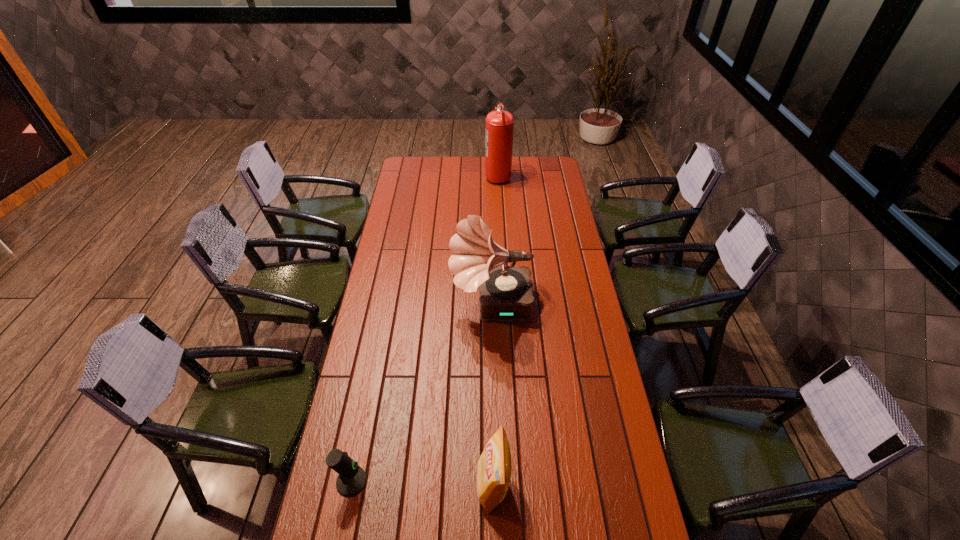
Locate an element on the screen. The height and width of the screenshot is (540, 960). fire extinguisher is located at coordinates (499, 128).

The width and height of the screenshot is (960, 540). In order to click on the third nearest object in this screenshot , I will do `click(506, 292)`.

Find the location of a particular element. the second shortest object is located at coordinates (494, 465).

You are a GUI agent. You are given a task and a screenshot of the screen. Output one action in this format:
    pyautogui.click(x=<x>, y=<y>)
    Task: Click on the leftmost object
    
    Given the screenshot: What is the action you would take?
    pyautogui.click(x=352, y=478)

The image size is (960, 540). Identify the location of the shortest object. (352, 478).

I want to click on vacant space situated 0.280m on the instruction side of the farthest object, so [x=436, y=175].

At what (x,y) coordinates should I click in order to perform the action: click on free space located 0.160m on the instruction side of the farthest object. Please return your answer as a coordinate pair (x, y). This screenshot has height=540, width=960. Looking at the image, I should click on (457, 175).

Find the location of a particular element. free space located on the instruction side of the farthest object is located at coordinates (433, 175).

You are a GUI agent. You are given a task and a screenshot of the screen. Output one action in this format:
    pyautogui.click(x=<x>, y=<y>)
    Task: Click on the vacant point located from the horn of the record player
    
    Given the screenshot: What is the action you would take?
    pyautogui.click(x=415, y=306)

Image resolution: width=960 pixels, height=540 pixels. In order to click on vacant area situated 0.140m from the horn of the record player in this screenshot , I will do `click(417, 306)`.